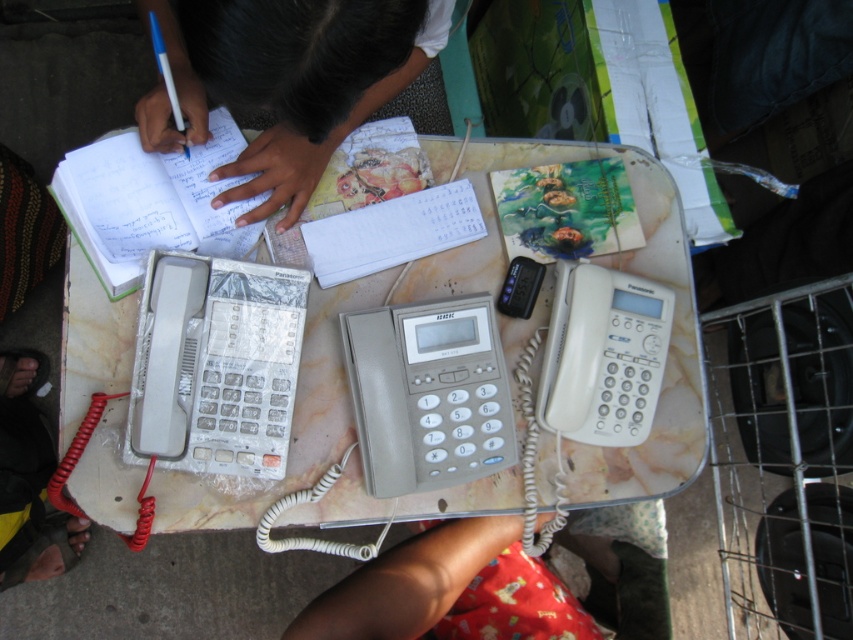
Question: Which point appears closest to the camera in this image?

Choices:
 (A) (532, 291)
 (B) (465, 166)
 (C) (367, 36)

Answer: (C)

Question: Which is nearer to the clear plastic calculator at left?

Choices:
 (A) black plastic phone at center
 (B) red fabric leg at lower center

Answer: (B)

Question: Is the position of clear plastic calculator at left more distant than that of black plastic phone at center?

Choices:
 (A) no
 (B) yes

Answer: (A)

Question: Estimate the real-world distances between objects in this image. Which object is farther from the marble table at center?

Choices:
 (A) red fabric leg at lower center
 (B) dark skin hands at upper center
 (C) black plastic phone at center
 (D) gray plastic calculator at center

Answer: (B)

Question: Is clear plastic calculator at left below black plastic phone at center?

Choices:
 (A) no
 (B) yes

Answer: (B)

Question: Does clear plastic calculator at left have a larger size compared to black fabric foot at lower left?

Choices:
 (A) no
 (B) yes

Answer: (A)